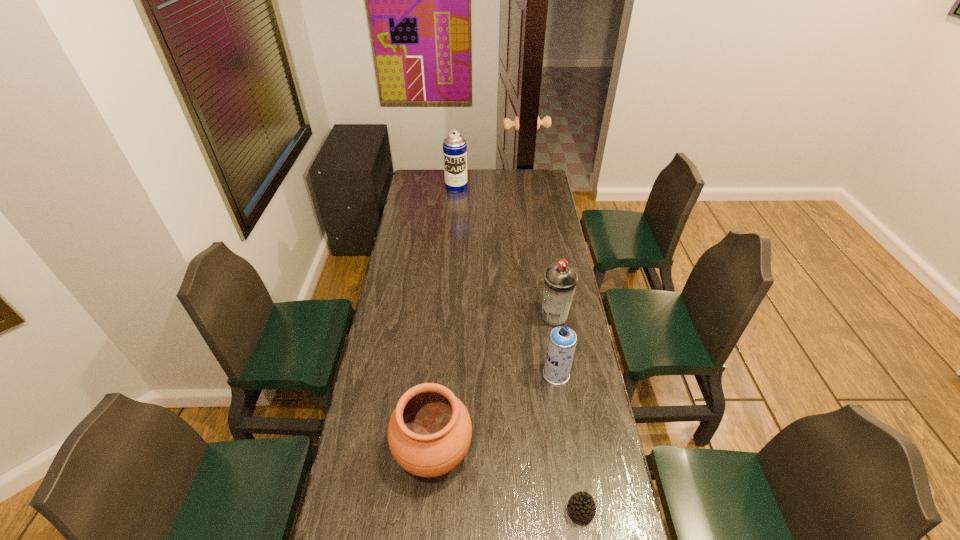
The width and height of the screenshot is (960, 540). What are the coordinates of `vacant space located on the left of the fourth nearest object` in the screenshot? It's located at (505, 317).

This screenshot has width=960, height=540. I want to click on vacant space located 0.250m on the back of the pottery, so pyautogui.click(x=441, y=356).

Locate an element on the screen. The image size is (960, 540). free space located 0.200m on the left of the third nearest object is located at coordinates (489, 374).

Locate an element on the screen. This screenshot has height=540, width=960. vacant region located 0.380m at the narrow end of the shortest object is located at coordinates (436, 510).

Identify the location of vacant space located at the narrow end of the shortest object. This screenshot has height=540, width=960. [x=436, y=510].

At what (x,y) coordinates should I click in order to perform the action: click on vacant space located 0.090m at the narrow end of the shortest object. Please return your answer as a coordinate pair (x, y). Image resolution: width=960 pixels, height=540 pixels. Looking at the image, I should click on (536, 510).

Locate an element on the screen. object located at the far edge is located at coordinates (454, 145).

Locate an element on the screen. Image resolution: width=960 pixels, height=540 pixels. object situated at the left edge is located at coordinates pos(429,433).

Locate an element on the screen. pinecone present at the right edge is located at coordinates (581, 505).

Find the location of a particular element. This screenshot has height=540, width=960. free region at the far edge of the desktop is located at coordinates (488, 172).